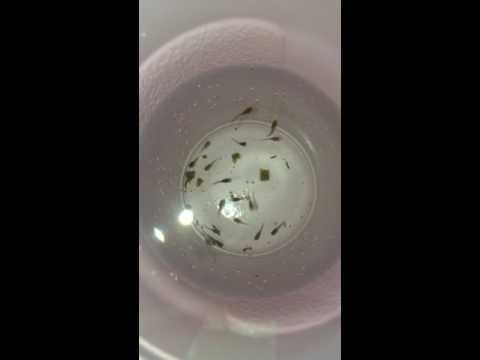
The width and height of the screenshot is (480, 360). I want to click on inner side of bowl, so click(x=208, y=96), click(x=302, y=107), click(x=329, y=230), click(x=191, y=275), click(x=161, y=199).